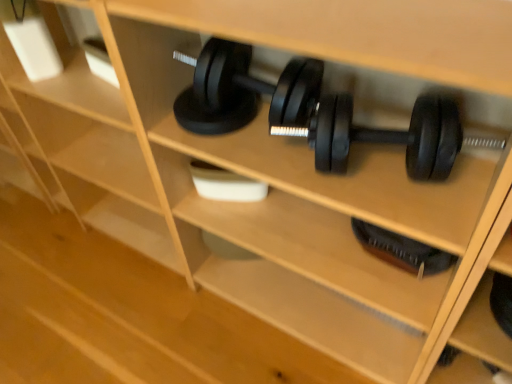
Question: Would you say black rubber dumbbell at lower center, which ranks as the 2th dumbbell in front-to-back order, contains black rubber dumbbell at center, the first dumbbell when ordered from front to back?

Choices:
 (A) no
 (B) yes

Answer: (A)

Question: Is black rubber dumbbell at lower center, which is the second dumbbell from top to bottom, far away from black rubber dumbbell at center, which is the first dumbbell in top-to-bottom order?

Choices:
 (A) no
 (B) yes

Answer: (A)

Question: Is black rubber dumbbell at lower center, the 1th dumbbell in the back-to-front sequence, thinner than black rubber dumbbell at center, which is the first dumbbell in top-to-bottom order?

Choices:
 (A) yes
 (B) no

Answer: (A)

Question: Is black rubber dumbbell at lower center, which is the second dumbbell from top to bottom, shorter than black rubber dumbbell at center, which is the first dumbbell in top-to-bottom order?

Choices:
 (A) yes
 (B) no

Answer: (A)

Question: Is black rubber dumbbell at lower center, which is the second dumbbell from top to bottom, turned away from black rubber dumbbell at center, which appears as the second dumbbell when viewed from the back?

Choices:
 (A) yes
 (B) no

Answer: (B)

Question: From the image's perspective, is black rubber dumbbell at lower center, which is the second dumbbell from top to bottom, over black rubber dumbbell at center, which is the first dumbbell in top-to-bottom order?

Choices:
 (A) yes
 (B) no

Answer: (B)

Question: Is the depth of black rubber dumbbell at center, which is the first dumbbell in top-to-bottom order, less than that of black rubber dumbbell at lower center, placed as the first dumbbell when sorted from bottom to top?

Choices:
 (A) no
 (B) yes

Answer: (B)

Question: Can you confirm if black rubber dumbbell at center, which is the first dumbbell in top-to-bottom order, is shorter than black rubber dumbbell at lower center, placed as the first dumbbell when sorted from bottom to top?

Choices:
 (A) no
 (B) yes

Answer: (A)

Question: Is black rubber dumbbell at lower center, placed as the first dumbbell when sorted from bottom to top, a part of black rubber dumbbell at center, the first dumbbell when ordered from front to back?

Choices:
 (A) yes
 (B) no

Answer: (B)

Question: From a real-world perspective, is black rubber dumbbell at center, placed as the second dumbbell when sorted from bottom to top, located higher than black rubber dumbbell at lower center, which ranks as the 2th dumbbell in front-to-back order?

Choices:
 (A) yes
 (B) no

Answer: (A)

Question: Is black rubber dumbbell at center, which appears as the second dumbbell when viewed from the back, turned away from black rubber dumbbell at lower center, which ranks as the 2th dumbbell in front-to-back order?

Choices:
 (A) no
 (B) yes

Answer: (A)

Question: Considering the relative sizes of black rubber dumbbell at center, which appears as the second dumbbell when viewed from the back, and black rubber dumbbell at lower center, placed as the first dumbbell when sorted from bottom to top, in the image provided, is black rubber dumbbell at center, which appears as the second dumbbell when viewed from the back, smaller than black rubber dumbbell at lower center, placed as the first dumbbell when sorted from bottom to top,?

Choices:
 (A) yes
 (B) no

Answer: (B)

Question: Is black rubber dumbbell at center, the first dumbbell when ordered from front to back, bigger or smaller than black rubber dumbbell at lower center, which ranks as the 2th dumbbell in front-to-back order?

Choices:
 (A) big
 (B) small

Answer: (A)